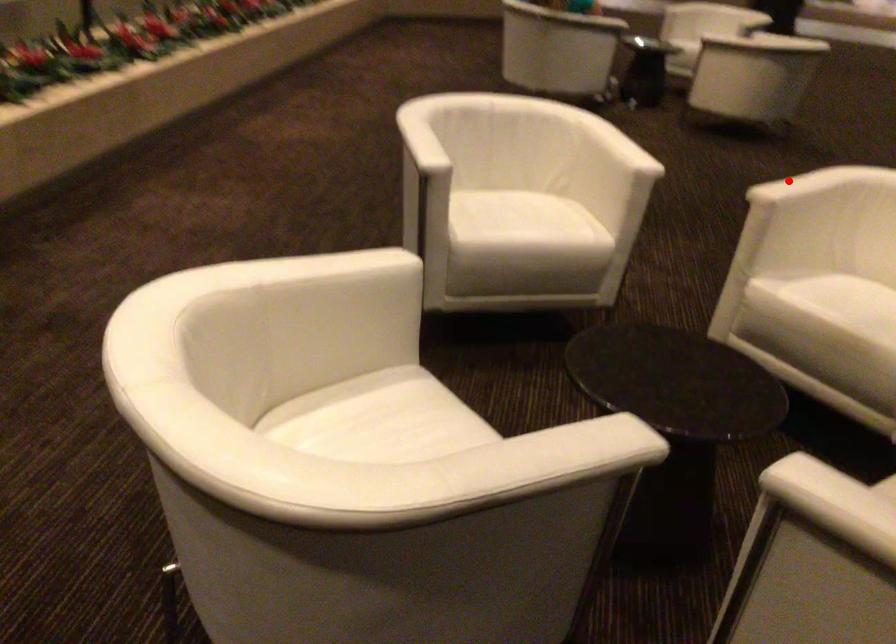
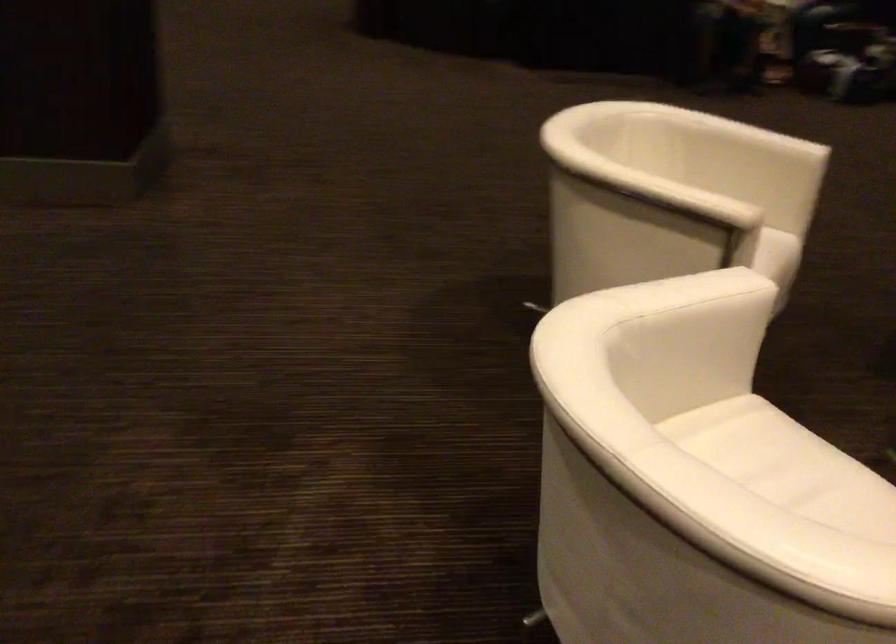
Find the pixel in the second image that matches the highlighted location in the first image.

(675, 194)